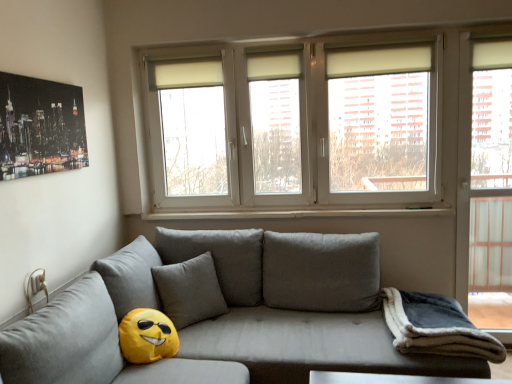
Find the location of a particular element. The image size is (512, 384). free point above white plastic window at upper center (from a real-world perspective) is located at coordinates (316, 34).